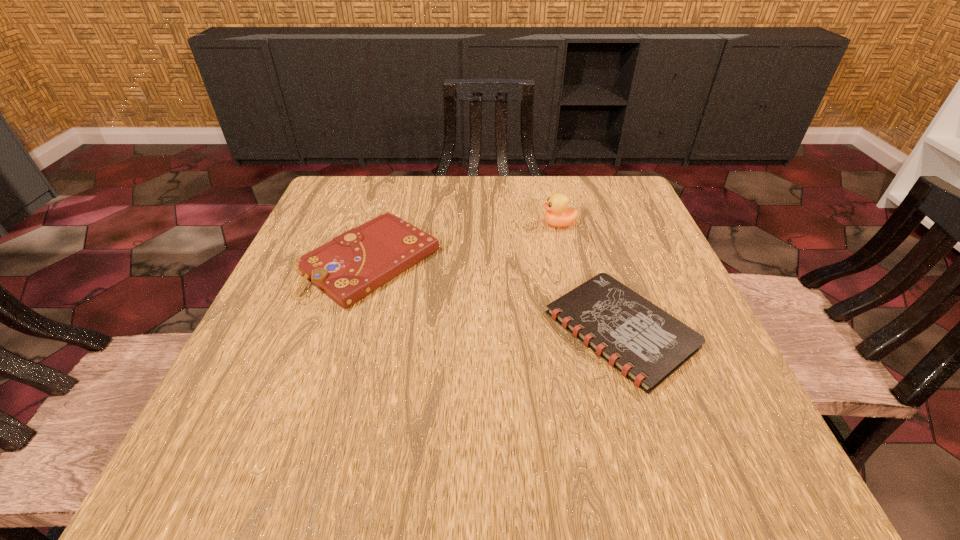
This screenshot has width=960, height=540. In the image, there is a desktop. What are the coordinates of `vacant space at the far right corner` in the screenshot? It's located at (612, 200).

Identify the location of vacant space at the near right corner of the desktop. The width and height of the screenshot is (960, 540). 670,455.

You are a GUI agent. You are given a task and a screenshot of the screen. Output one action in this format:
    pyautogui.click(x=<x>, y=<y>)
    Task: Click on the free space between the shortest object and the taller notebook
    Image resolution: width=960 pixels, height=540 pixels.
    Given the screenshot: What is the action you would take?
    pyautogui.click(x=495, y=296)

Locate an element on the screen. free space between the taller notebook and the duckling is located at coordinates (465, 242).

Image resolution: width=960 pixels, height=540 pixels. Find the location of `free space that is in between the left notebook and the duckling`. free space that is in between the left notebook and the duckling is located at coordinates (465, 242).

The width and height of the screenshot is (960, 540). I want to click on vacant point located between the duckling and the taller notebook, so click(465, 242).

The width and height of the screenshot is (960, 540). I want to click on unoccupied area between the tallest object and the taller notebook, so click(465, 242).

Where is `free space between the left notebook and the shorter notebook`? This screenshot has height=540, width=960. free space between the left notebook and the shorter notebook is located at coordinates (495, 296).

Image resolution: width=960 pixels, height=540 pixels. Find the location of `free area in between the tallest object and the shortest object`. free area in between the tallest object and the shortest object is located at coordinates (589, 277).

At what (x,y) coordinates should I click in order to perform the action: click on vacant space that's between the taller notebook and the right notebook. Please return your answer as a coordinate pair (x, y). Image resolution: width=960 pixels, height=540 pixels. Looking at the image, I should click on (495, 296).